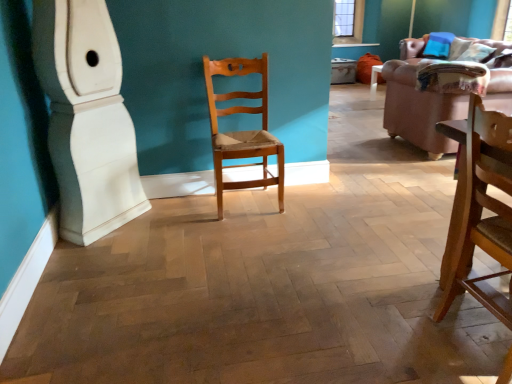
What do you see at coordinates (481, 214) in the screenshot?
I see `wooden chair at right, positioned as the 1th chair in front-to-back order` at bounding box center [481, 214].

In order to face brown leather couch at upper right, should I rotate leftwards or rightwards?

To face it directly, rotate right by 26.658 degrees.

The height and width of the screenshot is (384, 512). Describe the element at coordinates (418, 103) in the screenshot. I see `velvet pink couch at right` at that location.

Where is `wooden chair at right, positioned as the 1th chair in front-to-back order`? Image resolution: width=512 pixels, height=384 pixels. wooden chair at right, positioned as the 1th chair in front-to-back order is located at coordinates (481, 214).

Measure the distance between light brown wood chair at center, positioned as the second chair in front-to-back order, and wooden chair at right, which is the 2th chair in back-to-front order.

light brown wood chair at center, positioned as the second chair in front-to-back order, is 1.39 meters from wooden chair at right, which is the 2th chair in back-to-front order.

Considering the sizes of light brown wood chair at center, positioned as the second chair in front-to-back order, and wooden chair at right, the 1th chair viewed from the right, in the image, is light brown wood chair at center, positioned as the second chair in front-to-back order, bigger or smaller than wooden chair at right, the 1th chair viewed from the right,?

light brown wood chair at center, positioned as the second chair in front-to-back order, is bigger than wooden chair at right, the 1th chair viewed from the right.

You are a GUI agent. You are given a task and a screenshot of the screen. Output one action in this format:
    pyautogui.click(x=<x>, y=<y>)
    Task: Click on the chair behind the wooden chair at right, the 1th chair viewed from the right
    The width and height of the screenshot is (512, 384).
    Given the screenshot: What is the action you would take?
    pyautogui.click(x=242, y=131)

Looking at this image, which object is positioned more to the right, light brown wood chair at center, positioned as the second chair in front-to-back order, or wooden chair at right, the 1th chair viewed from the right?

From the viewer's perspective, wooden chair at right, the 1th chair viewed from the right, appears more on the right side.

Does point (386, 73) lie behind point (490, 138)?

Yes, point (386, 73) is farther from viewer.

Based on the photo, between velvet pink couch at right and wooden chair at right, marked as the second chair in a left-to-right arrangement, which one has smaller width?

With smaller width is wooden chair at right, marked as the second chair in a left-to-right arrangement.

Is velvet pink couch at right turned away from wooden chair at right, which is the 2th chair in back-to-front order?

That's right, velvet pink couch at right is facing away from wooden chair at right, which is the 2th chair in back-to-front order.

Is wooden chair at right, marked as the second chair in a left-to-right arrangement, beside light brown wood chair at center, the 1th chair from the back?

No, wooden chair at right, marked as the second chair in a left-to-right arrangement, is not making contact with light brown wood chair at center, the 1th chair from the back.

Is wooden chair at right, positioned as the 1th chair in front-to-back order, smaller than light brown wood chair at center, the second chair viewed from the right?

Correct, wooden chair at right, positioned as the 1th chair in front-to-back order, occupies less space than light brown wood chair at center, the second chair viewed from the right.

Locate an element on the screen. This screenshot has width=512, height=384. chair that is behind the wooden chair at right, the 1th chair viewed from the right is located at coordinates (242, 131).

How different are the orientations of wooden chair at right, the 1th chair viewed from the right, and light brown wood chair at center, which ranks as the 1th chair in left-to-right order, in degrees?

The facing directions of wooden chair at right, the 1th chair viewed from the right, and light brown wood chair at center, which ranks as the 1th chair in left-to-right order, are 90.4 degrees apart.

Considering the positions of objects brown leather couch at upper right and light brown wood chair at center, the second chair viewed from the right, in the image provided, who is more to the right, brown leather couch at upper right or light brown wood chair at center, the second chair viewed from the right,?

Positioned to the right is brown leather couch at upper right.

Who is taller, brown leather couch at upper right or light brown wood chair at center, the 1th chair from the back?

Standing taller between the two is light brown wood chair at center, the 1th chair from the back.

Is there a large distance between brown leather couch at upper right and light brown wood chair at center, the 1th chair from the back?

Indeed, brown leather couch at upper right is not near light brown wood chair at center, the 1th chair from the back.

Considering the sizes of objects brown leather couch at upper right and light brown wood chair at center, the second chair viewed from the right, in the image provided, who is wider, brown leather couch at upper right or light brown wood chair at center, the second chair viewed from the right,?

With larger width is brown leather couch at upper right.

Is brown leather couch at upper right at the right side of wooden chair at right, which is the 2th chair in back-to-front order?

Yes, brown leather couch at upper right is to the right of wooden chair at right, which is the 2th chair in back-to-front order.

This screenshot has width=512, height=384. Find the location of `the 1st chair counting from the left side of the brown leather couch at upper right`. the 1st chair counting from the left side of the brown leather couch at upper right is located at coordinates (481, 214).

How many degrees apart are the facing directions of brown leather couch at upper right and wooden chair at right, which is the 2th chair in back-to-front order?

The angle between the facing direction of brown leather couch at upper right and the facing direction of wooden chair at right, which is the 2th chair in back-to-front order, is 179 degrees.

From the image's perspective, is brown leather couch at upper right above or below wooden chair at right, which is the 2th chair in back-to-front order?

brown leather couch at upper right is situated higher than wooden chair at right, which is the 2th chair in back-to-front order, in the image.

From a real-world perspective, count 2nd chairs upward from the velvet pink couch at right and point to it. Please provide its 2D coordinates.

[(242, 131)]

Measure the distance from light brown wood chair at center, which ranks as the 1th chair in left-to-right order, to velvet pink couch at right.

light brown wood chair at center, which ranks as the 1th chair in left-to-right order, is 1.57 meters away from velvet pink couch at right.

Does light brown wood chair at center, which ranks as the 1th chair in left-to-right order, have a greater width compared to velvet pink couch at right?

In fact, light brown wood chair at center, which ranks as the 1th chair in left-to-right order, might be narrower than velvet pink couch at right.

Which is behind, point (216, 160) or point (389, 116)?

The point (389, 116) is more distant.

From a real-world perspective, between velvet pink couch at right and brown leather couch at upper right, who is vertically higher?

brown leather couch at upper right is physically above.

Is velvet pink couch at right surrounding brown leather couch at upper right?

That's incorrect, brown leather couch at upper right is not inside velvet pink couch at right.

From the image's perspective, is velvet pink couch at right positioned above or below brown leather couch at upper right?

Clearly, from the image's perspective, velvet pink couch at right is below brown leather couch at upper right.

At what (x,y) coordinates should I click in order to perform the action: click on studio couch lying on the left of brown leather couch at upper right. Please return your answer as a coordinate pair (x, y). Looking at the image, I should click on (418, 103).

Locate an element on the screen. chair positioned vertically above the wooden chair at right, which is the 2th chair in back-to-front order (from a real-world perspective) is located at coordinates (242, 131).

Where is `chair that is the 2nd object located in front of the velvet pink couch at right`? chair that is the 2nd object located in front of the velvet pink couch at right is located at coordinates (481, 214).

Looking at the image, which one is located further to wooden chair at right, the 1th chair viewed from the right, velvet pink couch at right or light brown wood chair at center, which ranks as the 1th chair in left-to-right order?

The object further to wooden chair at right, the 1th chair viewed from the right, is velvet pink couch at right.

Based on their spatial positions, is wooden chair at right, which is the 2th chair in back-to-front order, or light brown wood chair at center, positioned as the second chair in front-to-back order, further from velvet pink couch at right?

wooden chair at right, which is the 2th chair in back-to-front order, lies further to velvet pink couch at right than the other object.

Estimate the real-world distances between objects in this image. Which object is closer to wooden chair at right, which is the 2th chair in back-to-front order, light brown wood chair at center, positioned as the second chair in front-to-back order, or velvet pink couch at right?

light brown wood chair at center, positioned as the second chair in front-to-back order, is closer to wooden chair at right, which is the 2th chair in back-to-front order.

Considering their positions, is wooden chair at right, positioned as the 1th chair in front-to-back order, positioned further to brown leather couch at upper right than light brown wood chair at center, positioned as the second chair in front-to-back order?

Among the two, wooden chair at right, positioned as the 1th chair in front-to-back order, is located further to brown leather couch at upper right.

When comparing their distances from light brown wood chair at center, which ranks as the 1th chair in left-to-right order, does brown leather couch at upper right or wooden chair at right, positioned as the 1th chair in front-to-back order, seem further?

The object further to light brown wood chair at center, which ranks as the 1th chair in left-to-right order, is brown leather couch at upper right.

Estimate the real-world distances between objects in this image. Which object is further from velvet pink couch at right, brown leather couch at upper right or light brown wood chair at center, positioned as the second chair in front-to-back order?

brown leather couch at upper right is further to velvet pink couch at right.

Estimate the real-world distances between objects in this image. Which object is closer to wooden chair at right, which is the 2th chair in back-to-front order, brown leather couch at upper right or light brown wood chair at center, which ranks as the 1th chair in left-to-right order?

light brown wood chair at center, which ranks as the 1th chair in left-to-right order, is positioned closer to the anchor wooden chair at right, which is the 2th chair in back-to-front order.

When comparing their distances from brown leather couch at upper right, does light brown wood chair at center, the 1th chair from the back, or velvet pink couch at right seem closer?

velvet pink couch at right.

Where is `studio couch positioned between wooden chair at right, positioned as the 1th chair in front-to-back order, and brown leather couch at upper right from near to far`? The image size is (512, 384). studio couch positioned between wooden chair at right, positioned as the 1th chair in front-to-back order, and brown leather couch at upper right from near to far is located at coordinates (418, 103).

Identify the location of chair between wooden chair at right, the 1th chair viewed from the right, and velvet pink couch at right, along the z-axis. (242, 131).

The image size is (512, 384). In order to click on chair between wooden chair at right, marked as the second chair in a left-to-right arrangement, and brown leather couch at upper right in the front-back direction in this screenshot , I will do `click(242, 131)`.

Locate an element on the screen. studio couch situated between light brown wood chair at center, which ranks as the 1th chair in left-to-right order, and brown leather couch at upper right from left to right is located at coordinates (418, 103).